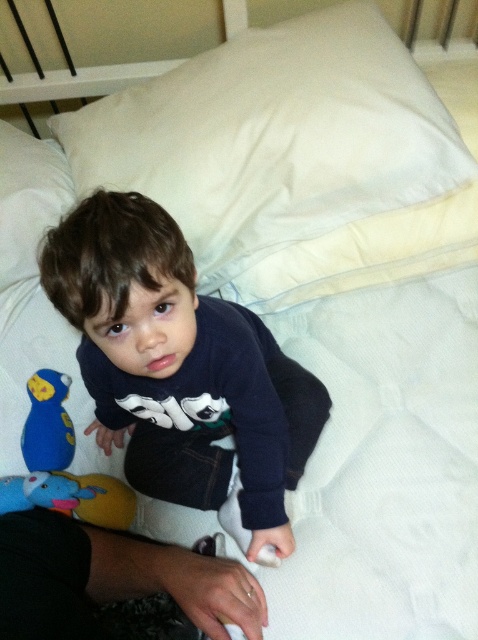
Question: Among these objects, which one is nearest to the camera?

Choices:
 (A) white soft pillow at upper left
 (B) dark blue jeans at lower left
 (C) blue plush toy at lower left
 (D) dark blue sweater at center

Answer: (B)

Question: Does white soft pillow at upper center lie behind blue plush toy at lower left?

Choices:
 (A) yes
 (B) no

Answer: (A)

Question: Is dark blue jeans at lower left positioned in front of white soft pillow at upper left?

Choices:
 (A) yes
 (B) no

Answer: (A)

Question: Is white soft pillow at upper center to the left of dark blue jeans at lower left from the viewer's perspective?

Choices:
 (A) no
 (B) yes

Answer: (A)

Question: Which point is closer to the camera?

Choices:
 (A) white soft pillow at upper left
 (B) dark blue jeans at lower left
 (C) dark blue sweater at center
 (D) white soft pillow at upper center

Answer: (B)

Question: Which point is closer to the camera?

Choices:
 (A) (42, 157)
 (B) (155, 556)
 (C) (358, 40)
 (D) (53, 392)

Answer: (B)